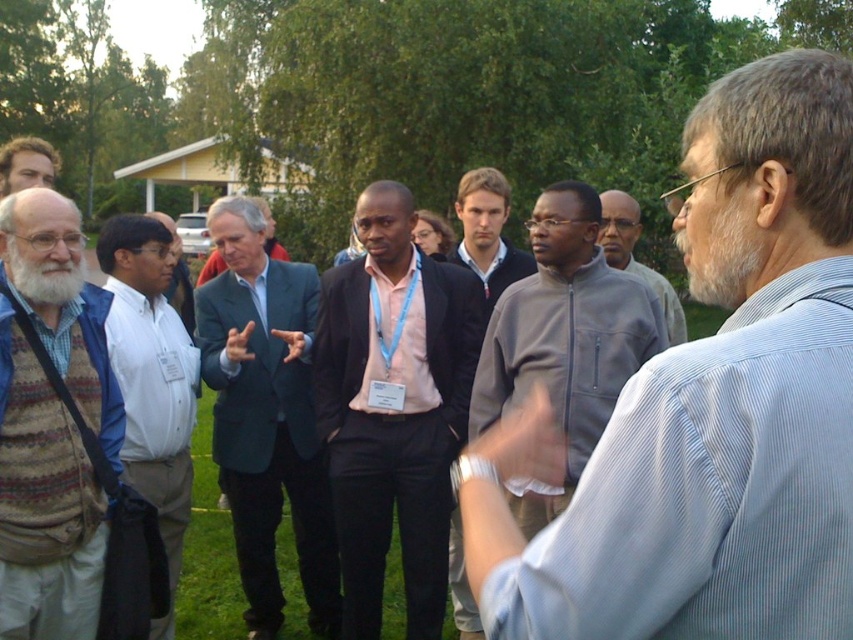
You are a photographer trying to capture a candid shot of the white shirt at center and the matte black jacket at upper left. Based on their positions, which subject would you focus on first to ensure both are in frame?

The white shirt at center is located below the matte black jacket at upper left, so focusing on the matte black jacket at upper left first would allow you to adjust the framing downward to include the white shirt at center in the shot.

You are standing at point (466, 224) and want to move to point (721, 531). Is the destination point in front of or behind you?

The destination point (721, 531) is in front of you because it is located in front of point (466, 224).